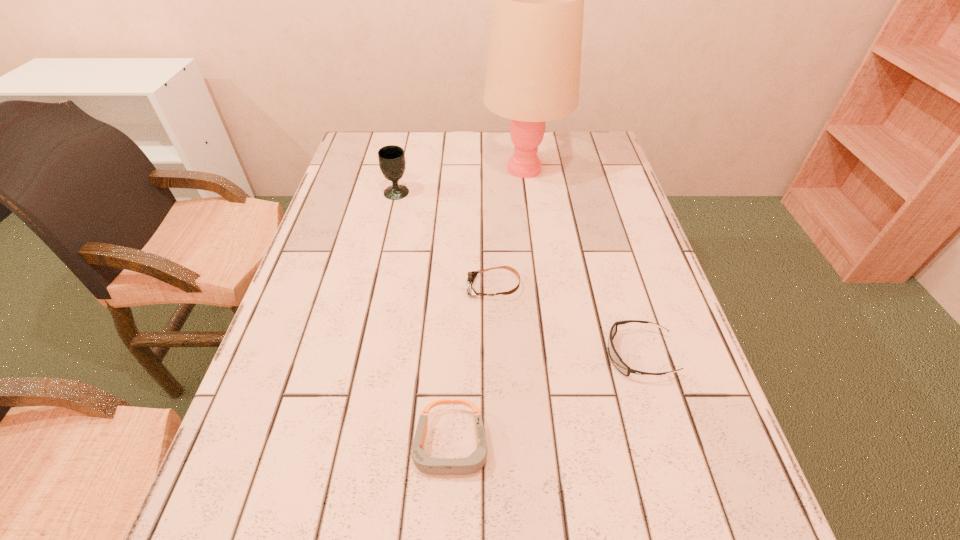
The width and height of the screenshot is (960, 540). In the image, there is a desktop. Identify the location of vacant space at the near edge. (348, 530).

Find the location of a particular element. This screenshot has height=540, width=960. vacant space at the left edge is located at coordinates (279, 354).

In the image, there is a desktop. At what (x,y) coordinates should I click in order to perform the action: click on vacant space at the right edge. Please return your answer as a coordinate pair (x, y). The width and height of the screenshot is (960, 540). Looking at the image, I should click on (712, 468).

Identify the location of vacant space at the far left corner. The width and height of the screenshot is (960, 540). (358, 161).

In the image, there is a desktop. Where is `blank space at the far right corner`? This screenshot has height=540, width=960. blank space at the far right corner is located at coordinates (558, 136).

This screenshot has width=960, height=540. Identify the location of blank space at the near right corner. 756,538.

Image resolution: width=960 pixels, height=540 pixels. Identify the location of free area in between the third farthest object and the leftmost object. (445, 240).

Where is `blank region between the farthest goggles and the second farthest goggles`? blank region between the farthest goggles and the second farthest goggles is located at coordinates (566, 321).

Locate an element on the screen. The height and width of the screenshot is (540, 960). empty space that is in between the lampshade and the nearest goggles is located at coordinates (488, 307).

Locate an element on the screen. This screenshot has height=540, width=960. vacant point located between the farthest goggles and the tallest object is located at coordinates (509, 227).